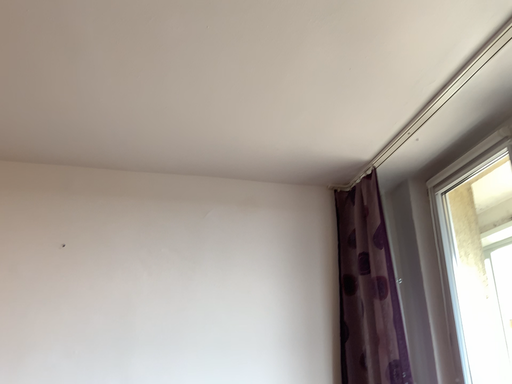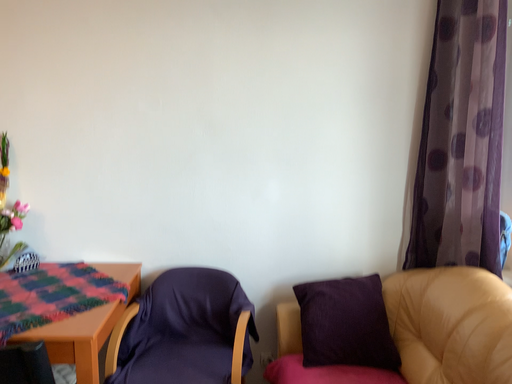
Question: Which way did the camera rotate in the video?

Choices:
 (A) rotated downward
 (B) rotated upward

Answer: (A)